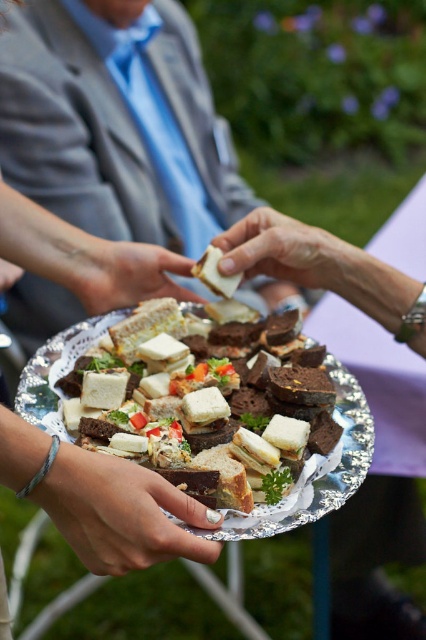
Can you confirm if satin silver tray at lower center is positioned above white matte sandwich at center?

Incorrect, satin silver tray at lower center is not positioned above white matte sandwich at center.

Between point (83, 493) and point (235, 269), which one is positioned in front?

Point (83, 493) is more forward.

Is point (103, 556) farther from viewer compared to point (270, 225)?

No, (103, 556) is closer to viewer.

At what (x,y) coordinates should I click in order to perform the action: click on satin silver tray at lower center. Please return your answer as a coordinate pair (x, y). The width and height of the screenshot is (426, 640). Looking at the image, I should click on (120, 513).

Can you confirm if sliced bread at center is positioned to the left of satin silver tray at lower center?

Incorrect, sliced bread at center is not on the left side of satin silver tray at lower center.

Does sliced bread at center have a larger size compared to satin silver tray at lower center?

Correct, sliced bread at center is larger in size than satin silver tray at lower center.

Does point (158, 412) lie behind point (146, 480)?

That is True.

Locate an element on the screen. The width and height of the screenshot is (426, 640). sliced bread at center is located at coordinates (198, 412).

Based on the photo, which is below, satin silver tray at lower center or smooth skin hand at center?

Positioned lower is satin silver tray at lower center.

What are the coordinates of `satin silver tray at lower center` in the screenshot? It's located at (120, 513).